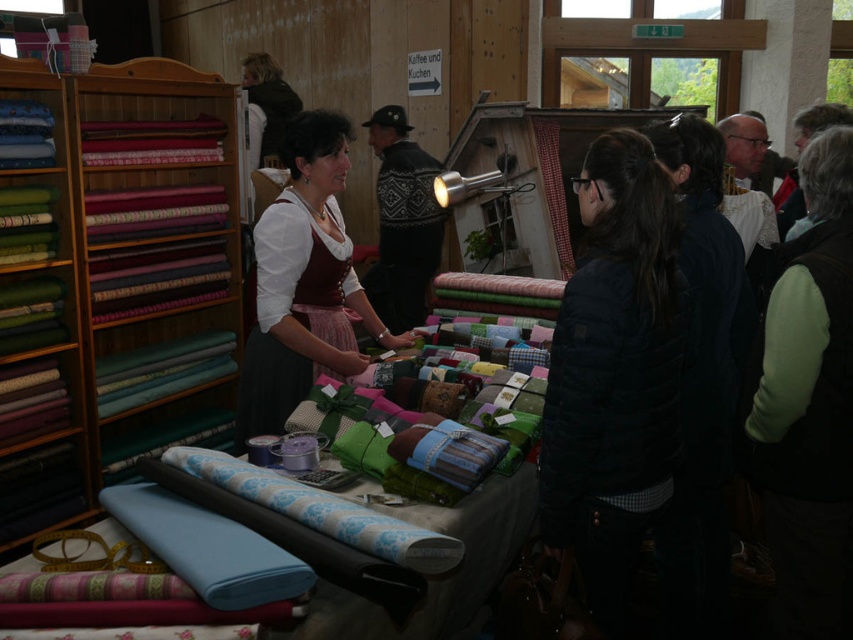
You are a customer in the fabric shop and want to know which item is taller between the matte green fabric at left and the matte brown skirt at center. Can you tell me?

The matte green fabric at left is much taller than the matte brown skirt at center.